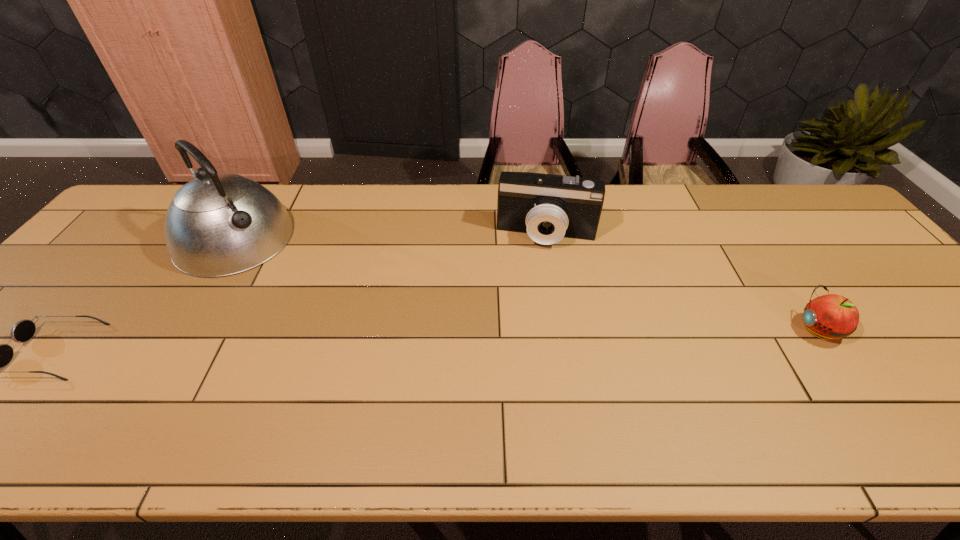
I want to click on vacant space at the right edge of the desktop, so click(928, 353).

Where is `free point between the apple and the kettle`? free point between the apple and the kettle is located at coordinates (526, 284).

Image resolution: width=960 pixels, height=540 pixels. What are the coordinates of `vacant area that lies between the second object from right to left and the apple` in the screenshot? It's located at (683, 282).

I want to click on vacant point located between the camcorder and the third object from right to left, so click(x=391, y=237).

Identify the location of vacant space that's between the third tallest object and the camcorder. This screenshot has height=540, width=960. (683, 282).

Find the location of a particular element. This screenshot has width=960, height=540. object that ranks as the second closest to the sunglasses is located at coordinates (547, 207).

Locate which object is the second closest to the rightmost object. Please provide its 2D coordinates. Your answer should be formatted as a tuple, i.e. [(x, y)], where the tuple contains the x and y coordinates of a point satisfying the conditions above.

[(219, 224)]

This screenshot has width=960, height=540. In order to click on free point that satisfies the following two spatial constraints: 1. on the front side of the kettle; 2. on the surface of the apple in this screenshot , I will do [x=180, y=329].

The image size is (960, 540). In order to click on vacant space that satisfies the following two spatial constraints: 1. on the front side of the tallest object; 2. on the surface of the apple in this screenshot , I will do `click(180, 329)`.